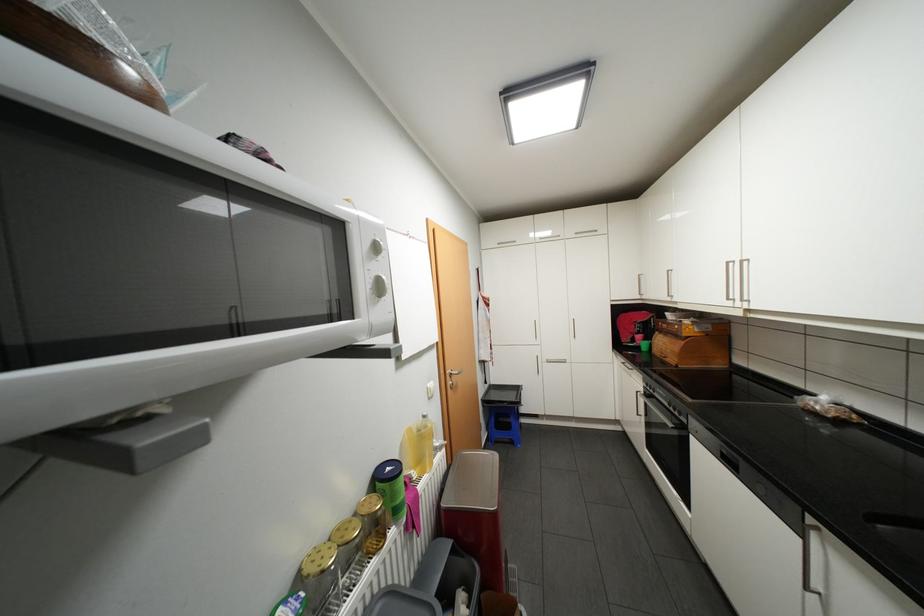
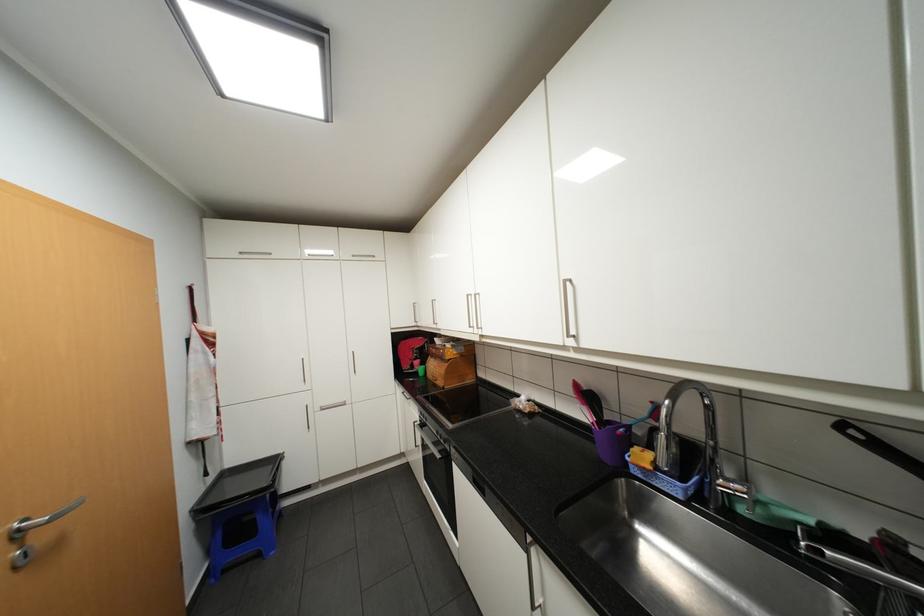
Question: The camera is either moving clockwise (left) or counter-clockwise (right) around the object. The first image is from the beginning of the video and the second image is from the end. Is the camera moving left or right when shooting the video?

Choices:
 (A) Left
 (B) Right

Answer: (A)